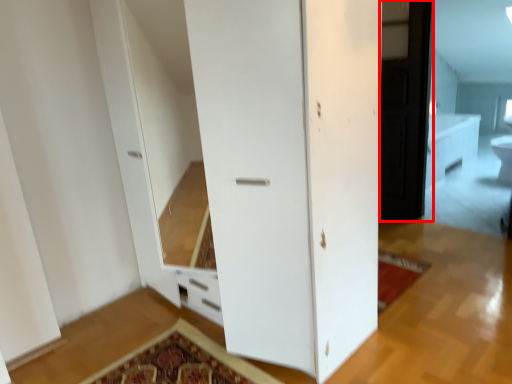
Question: In this image, where is screen door (annotated by the red box) located relative to toilet bowl?

Choices:
 (A) right
 (B) left

Answer: (B)